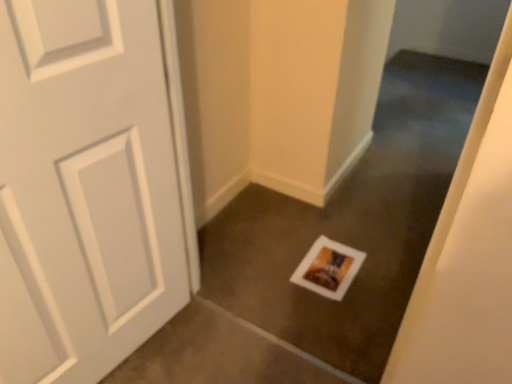
Image resolution: width=512 pixels, height=384 pixels. What do you see at coordinates (328, 268) in the screenshot? I see `white matte postcard at center` at bounding box center [328, 268].

Measure the distance between white matte postcard at center and camera.

white matte postcard at center and camera are 1.61 meters apart from each other.

In order to face white matte postcard at center, should I rotate leftwards or rightwards?

To face it directly, rotate right by 9.849 degrees.

Locate an element on the screen. The height and width of the screenshot is (384, 512). white matte postcard at center is located at coordinates (328, 268).

The image size is (512, 384). In order to click on white matte picture frame at center in this screenshot , I will do `click(351, 224)`.

The width and height of the screenshot is (512, 384). Describe the element at coordinates (351, 224) in the screenshot. I see `white matte picture frame at center` at that location.

In order to click on white matte postcard at center in this screenshot , I will do `click(328, 268)`.

Is white matte picture frame at center to the right of white matte postcard at center from the viewer's perspective?

Incorrect, white matte picture frame at center is not on the right side of white matte postcard at center.

Does white matte picture frame at center come in front of white matte postcard at center?

Yes, white matte picture frame at center is closer to the viewer.

Considering the points (294, 307) and (325, 245), which point is behind, point (294, 307) or point (325, 245)?

The point (325, 245) is farther.

In the scene shown: From the image's perspective, which object appears higher, white matte picture frame at center or white matte postcard at center?

white matte picture frame at center appears higher in the image.

From a real-world perspective, is white matte picture frame at center positioned over white matte postcard at center based on gravity?

Yes, from a real-world perspective, white matte picture frame at center is on top of white matte postcard at center.

Between white matte picture frame at center and white matte postcard at center, which one has smaller width?

white matte picture frame at center.

Considering the relative sizes of white matte picture frame at center and white matte postcard at center in the image provided, is white matte picture frame at center taller than white matte postcard at center?

Correct, white matte picture frame at center is much taller as white matte postcard at center.

Considering the relative sizes of white matte picture frame at center and white matte postcard at center in the image provided, is white matte picture frame at center bigger than white matte postcard at center?

Yes, white matte picture frame at center is bigger than white matte postcard at center.

Choose the correct answer: Is white matte picture frame at center inside white matte postcard at center or outside it?

white matte picture frame at center is not inside white matte postcard at center, it's outside.

Are white matte picture frame at center and white matte postcard at center located far from each other?

No, white matte picture frame at center is not far from white matte postcard at center.

Does white matte picture frame at center turn towards white matte postcard at center?

Yes.

How different are the orientations of white matte picture frame at center and white matte postcard at center in degrees?

179 degrees separate the facing orientations of white matte picture frame at center and white matte postcard at center.

Locate an element on the screen. postcard below the white matte picture frame at center (from the image's perspective) is located at coordinates (328, 268).

Is white matte postcard at center to the right of white matte picture frame at center from the viewer's perspective?

Yes.

Does white matte postcard at center come behind white matte picture frame at center?

Yes, white matte postcard at center is further from the viewer.

Is point (328, 274) farther from camera compared to point (401, 221)?

That is False.

From the image's perspective, is white matte postcard at center located beneath white matte picture frame at center?

Indeed, from the image's perspective, white matte postcard at center is shown beneath white matte picture frame at center.

From a real-world perspective, is white matte postcard at center physically located above or below white matte picture frame at center?

Clearly, from a real-world perspective, white matte postcard at center is below white matte picture frame at center.

Is white matte postcard at center wider or thinner than white matte picture frame at center?

Considering their sizes, white matte postcard at center looks broader than white matte picture frame at center.

Between white matte postcard at center and white matte picture frame at center, which one has more height?

Standing taller between the two is white matte picture frame at center.

Is white matte postcard at center smaller than white matte picture frame at center?

Yes, white matte postcard at center is smaller than white matte picture frame at center.

Is white matte postcard at center situated inside white matte picture frame at center or outside?

white matte postcard at center is spatially situated outside white matte picture frame at center.

Is white matte postcard at center beside white matte picture frame at center?

white matte postcard at center and white matte picture frame at center are not in contact.

Is white matte postcard at center looking in the opposite direction of white matte picture frame at center?

No.

This screenshot has height=384, width=512. I want to click on concrete on the left of white matte postcard at center, so (x=351, y=224).

In order to click on postcard that is under the white matte picture frame at center (from a real-world perspective) in this screenshot , I will do (328, 268).

The height and width of the screenshot is (384, 512). In order to click on concrete that appears above the white matte postcard at center (from the image's perspective) in this screenshot , I will do `click(351, 224)`.